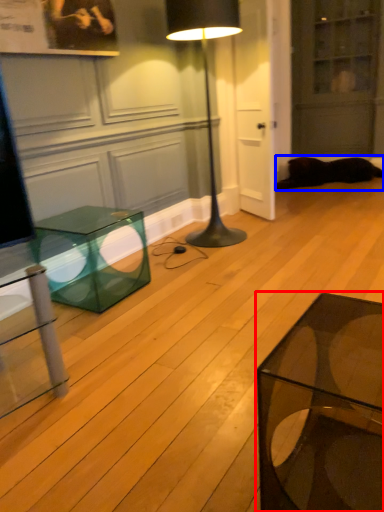
Question: Among these objects, which one is nearest to the camera, coffee table (highlighted by a red box) or cat (highlighted by a blue box)?

Choices:
 (A) coffee table
 (B) cat

Answer: (A)